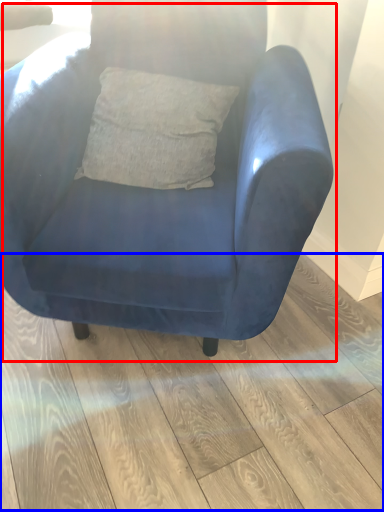
Question: Among these objects, which one is farthest to the camera, chair (highlighted by a red box) or plank (highlighted by a blue box)?

Choices:
 (A) chair
 (B) plank

Answer: (B)